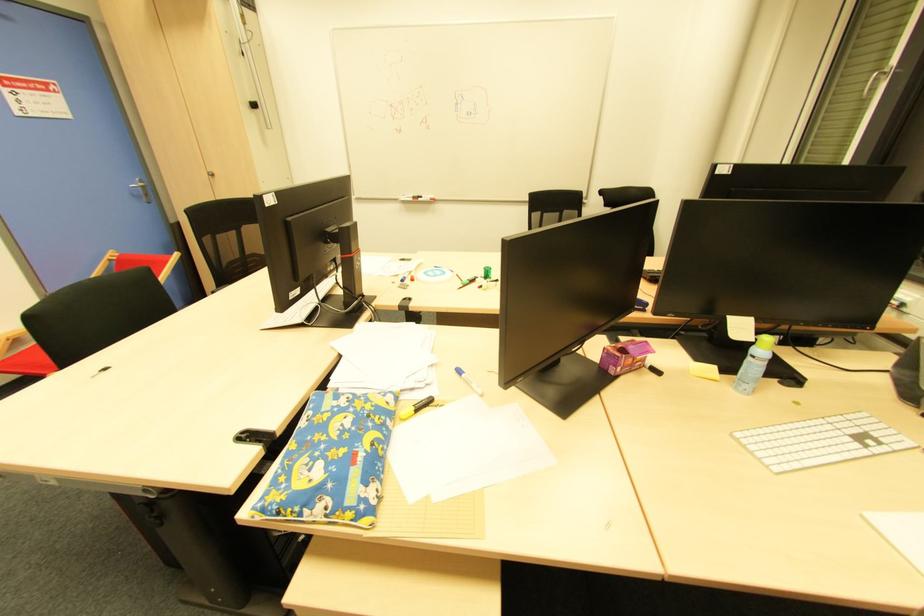
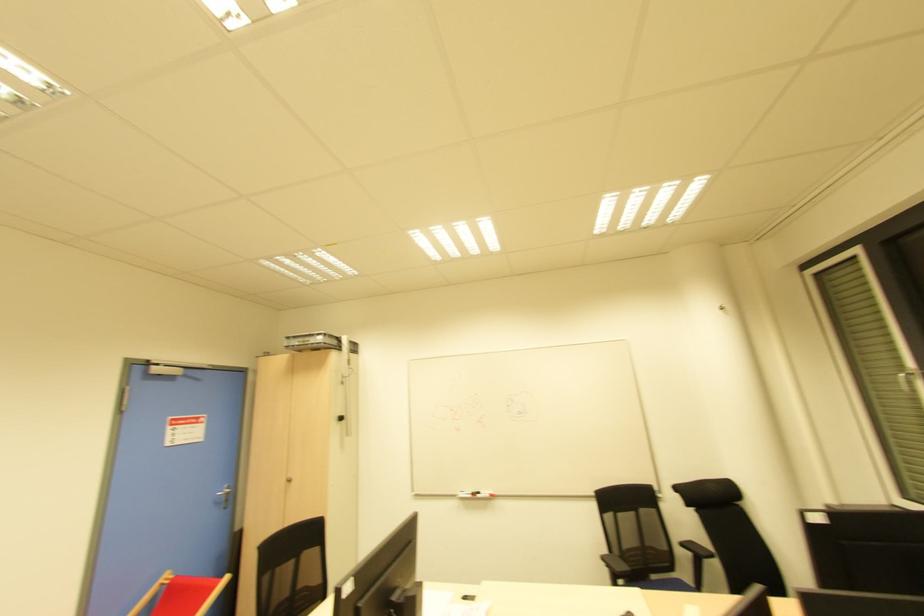
Question: Based on the continuous images, in which direction is the camera rotating? Reply with the corresponding letter.

Choices:
 (A) Left
 (B) Right
 (C) Up
 (D) Down

Answer: (C)